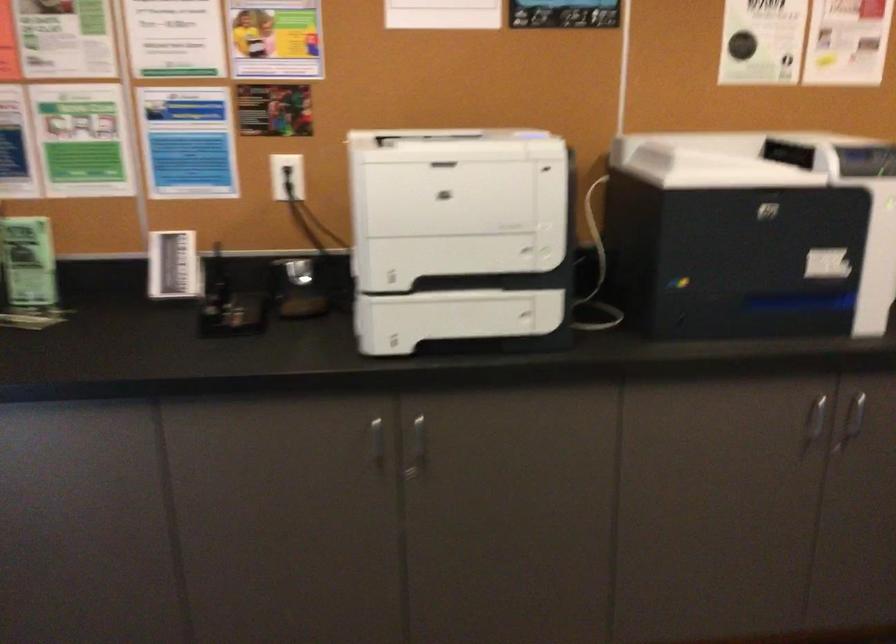
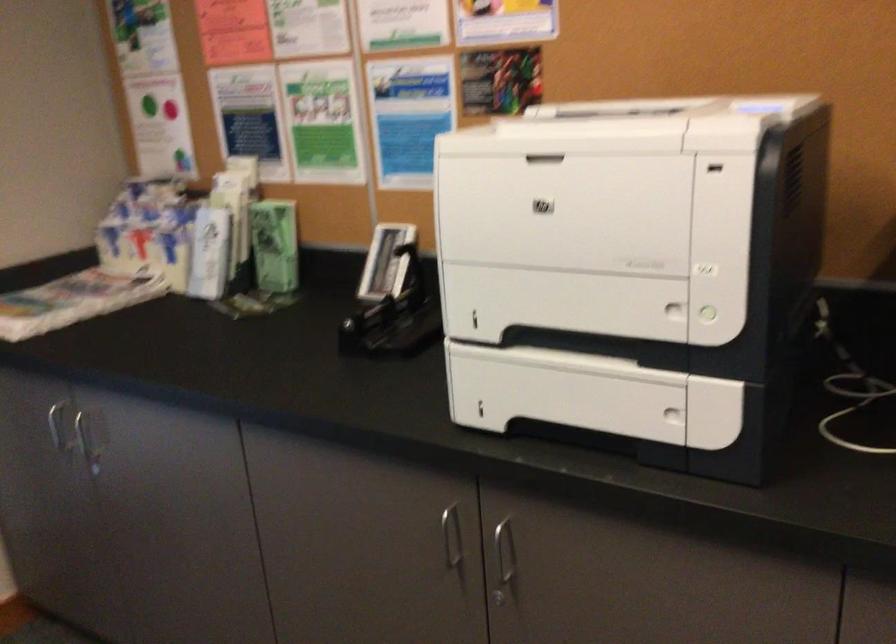
Find the pixel in the second image that matches [545,252] in the first image.

(709, 314)